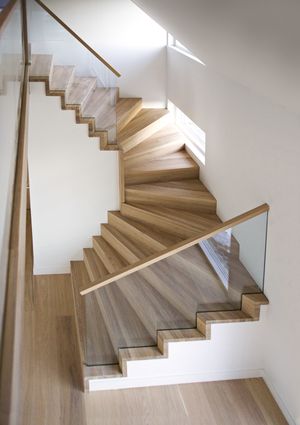
At what (x,y) coordinates should I click in order to perform the action: click on white walls. Please return your answer as a coordinate pair (x, y). This screenshot has width=300, height=425. Looking at the image, I should click on (225, 357), (296, 289), (274, 21), (125, 44), (68, 163).